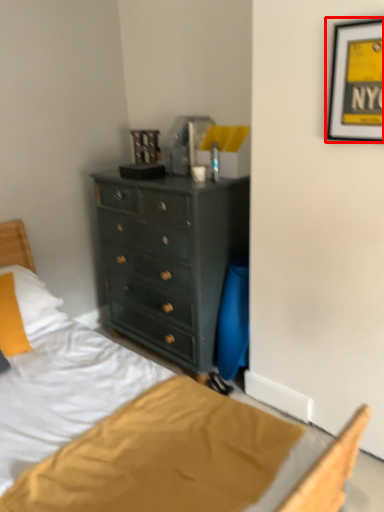
Question: From the image, what is the correct spatial relationship of picture frame (annotated by the red box) in relation to pillow?

Choices:
 (A) left
 (B) right

Answer: (B)